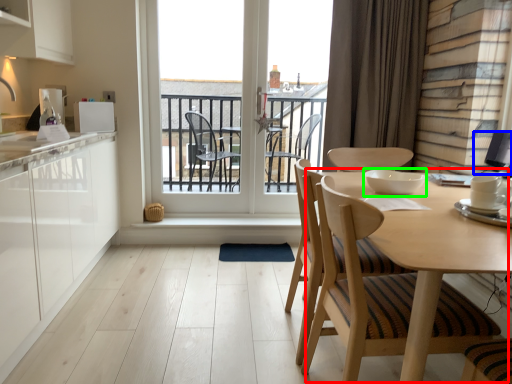
Question: Which object is the closest to the round table (highlighted by a red box)? Choose among these: appliance (highlighted by a blue box) or appliance (highlighted by a green box).

Choices:
 (A) appliance
 (B) appliance

Answer: (B)